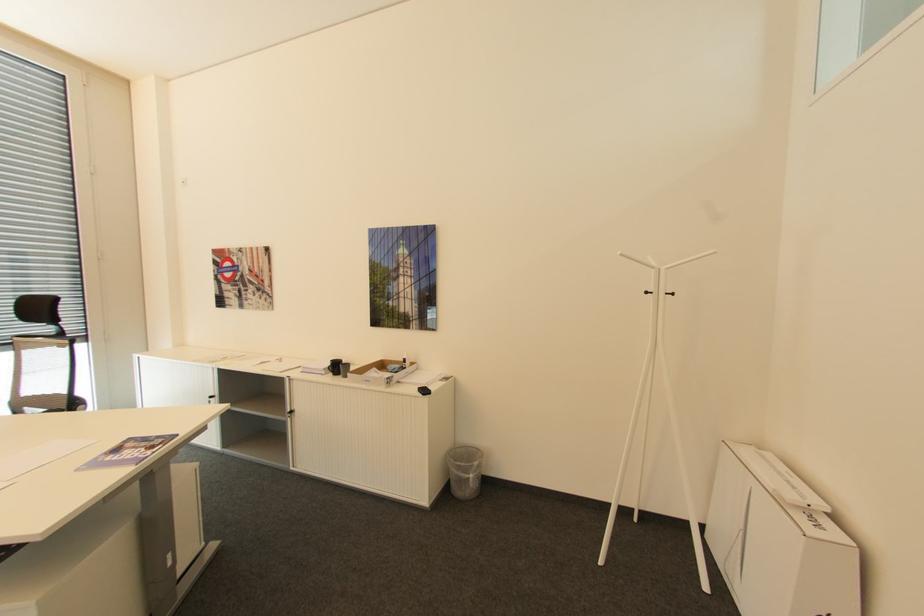
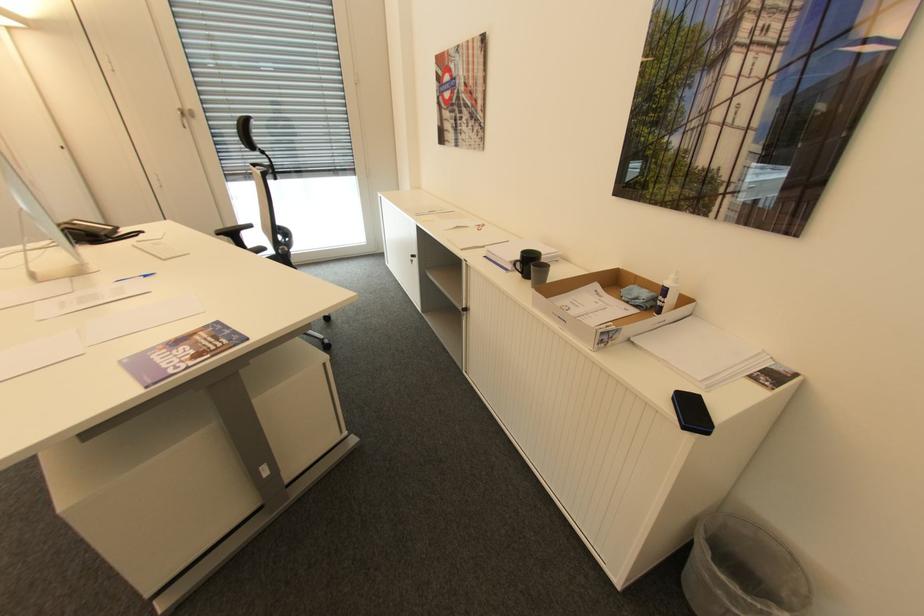
Where in the second image is the point corresponding to [408,360] from the first image?

(670, 291)